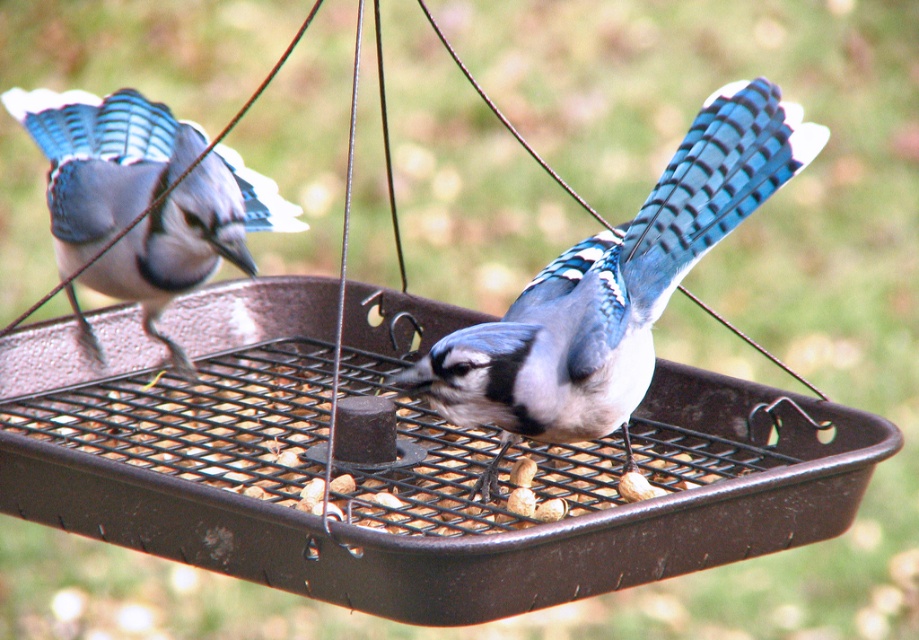
Question: Can you confirm if blue glossy feathers at center is bigger than matte blue feathers at left?

Choices:
 (A) no
 (B) yes

Answer: (B)

Question: Where is blue glossy feathers at center located in relation to matte blue feathers at left in the image?

Choices:
 (A) below
 (B) above

Answer: (A)

Question: Which point appears closest to the camera in this image?

Choices:
 (A) (787, 122)
 (B) (169, 243)

Answer: (A)

Question: Which point is farther to the camera?

Choices:
 (A) matte blue feathers at left
 (B) blue glossy feathers at center

Answer: (A)

Question: Does blue glossy feathers at center lie behind matte blue feathers at left?

Choices:
 (A) yes
 (B) no

Answer: (B)